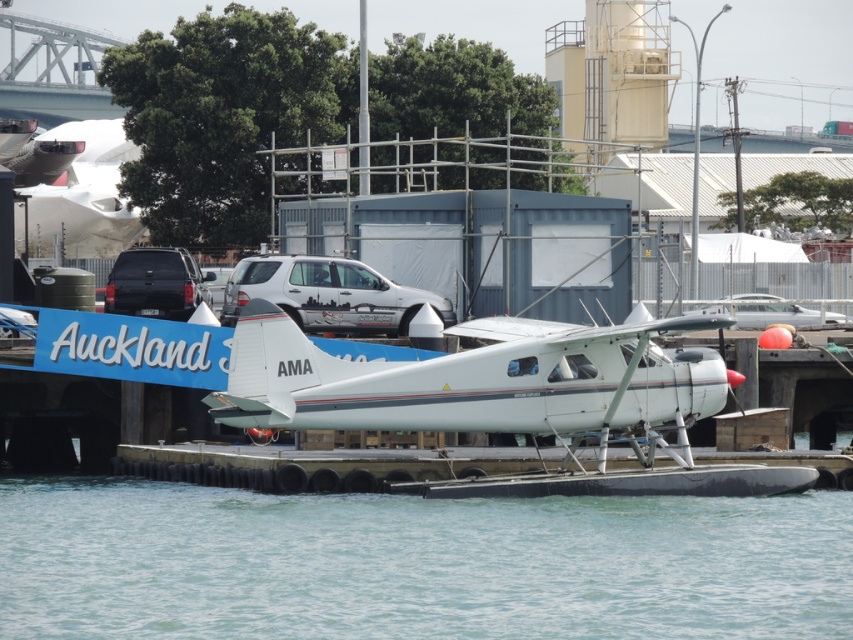
Question: Which object is farther from the camera taking this photo?

Choices:
 (A) white matte seaplane at center
 (B) matte black suv at upper left

Answer: (B)

Question: Does white matte seaplane at center appear on the left side of matte black suv at upper left?

Choices:
 (A) yes
 (B) no

Answer: (B)

Question: Can you confirm if clear blue water at lower center is positioned to the right of white matte seaplane at center?

Choices:
 (A) yes
 (B) no

Answer: (B)

Question: Does clear blue water at lower center appear over white matte seaplane at center?

Choices:
 (A) yes
 (B) no

Answer: (B)

Question: Among these objects, which one is farthest from the camera?

Choices:
 (A) white matte seaplane at center
 (B) clear blue water at lower center

Answer: (A)

Question: Which point is farther from the camera taking this photo?

Choices:
 (A) (695, 387)
 (B) (125, 291)

Answer: (B)